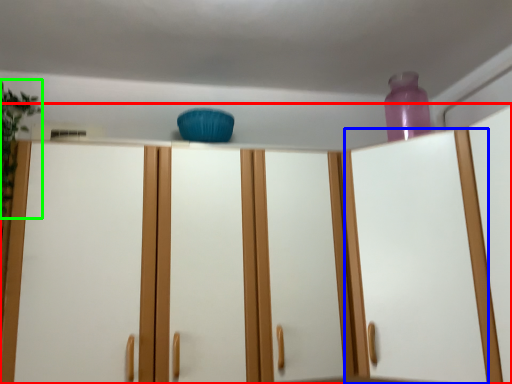
Question: Which object is positioned farthest from cupboard (highlighted by a red box)? Select from glass door (highlighted by a blue box) and plant (highlighted by a green box).

Choices:
 (A) glass door
 (B) plant

Answer: (B)